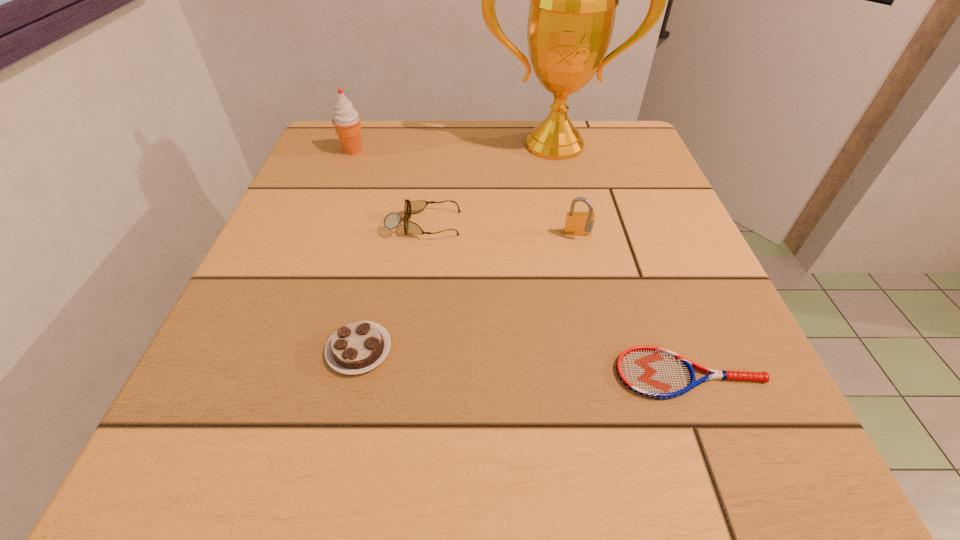
The width and height of the screenshot is (960, 540). I want to click on free space between the third tallest object and the tallest object, so click(x=566, y=190).

Identify the location of vacant area between the chocolate cake and the award. This screenshot has width=960, height=540. pos(457,247).

Locate an element on the screen. The width and height of the screenshot is (960, 540). vacant point located between the second shortest object and the award is located at coordinates (457, 247).

In order to click on unoccupied area between the leftmost object and the second shortest object in this screenshot , I will do `click(356, 250)`.

At what (x,y) coordinates should I click in order to perform the action: click on free space that is in between the tallest object and the tennis racket. Please return your answer as a coordinate pair (x, y). This screenshot has width=960, height=540. Looking at the image, I should click on (622, 259).

In order to click on vacant area between the fifth shortest object and the spectacles in this screenshot , I will do `click(389, 187)`.

Identify the location of free space between the spectacles and the fourth shortest object. (501, 230).

Locate an element on the screen. The height and width of the screenshot is (540, 960). the third closest object to the shortest object is located at coordinates (392, 220).

In order to click on object that is the second closest one to the award in this screenshot , I will do `click(580, 223)`.

The height and width of the screenshot is (540, 960). What are the coordinates of `free space that satisfies the following two spatial constraints: 1. on the front side of the tennis racket; 2. on the left side of the chocolate cake` in the screenshot? It's located at (353, 374).